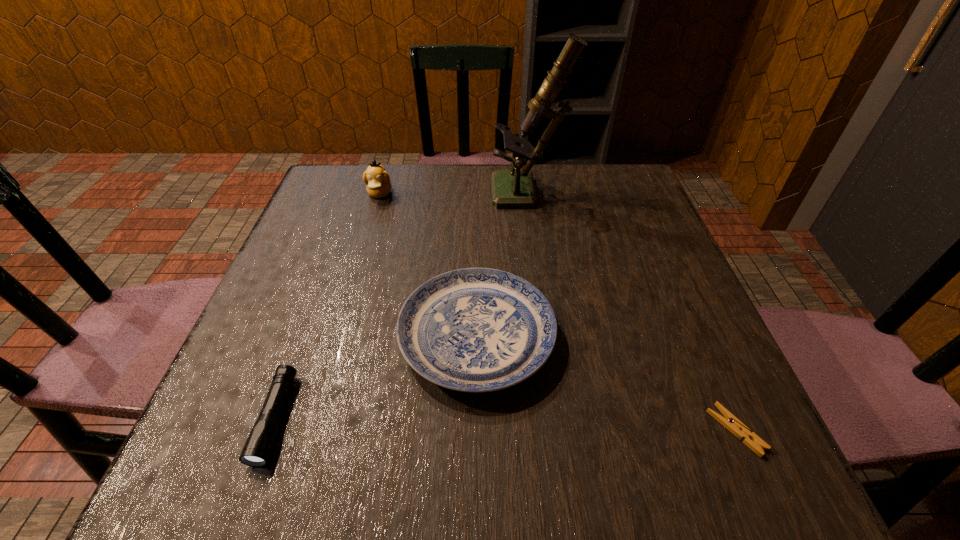
At what (x,y) coordinates should I click in order to perform the action: click on the tallest object. Please return your answer as a coordinate pair (x, y). Looking at the image, I should click on (510, 188).

The width and height of the screenshot is (960, 540). I want to click on the fourth object from right to left, so click(x=377, y=179).

The width and height of the screenshot is (960, 540). What are the coordinates of `duckling` in the screenshot? It's located at (377, 179).

Find the location of a particular element. Image resolution: width=960 pixels, height=540 pixels. plate is located at coordinates (475, 330).

Where is `the leftmost object`? Image resolution: width=960 pixels, height=540 pixels. the leftmost object is located at coordinates (257, 449).

The height and width of the screenshot is (540, 960). Find the location of `the rightmost object`. the rightmost object is located at coordinates (729, 421).

This screenshot has height=540, width=960. Identify the location of clothespin. click(x=729, y=421).

Where is `vacant region located 0.280m at the eyepiece of the microscope`? vacant region located 0.280m at the eyepiece of the microscope is located at coordinates (383, 195).

Locate an element on the screen. This screenshot has height=540, width=960. vacant region located 0.230m at the eyepiece of the microscope is located at coordinates (402, 195).

Find the location of a particular element. vacant region located at the eyepiece of the microscope is located at coordinates (422, 195).